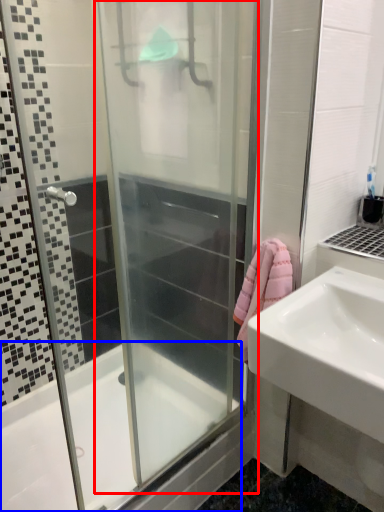
Question: Which of the following is the farthest to the observer, screen door (highlighted by a red box) or bathtub (highlighted by a blue box)?

Choices:
 (A) screen door
 (B) bathtub

Answer: (B)